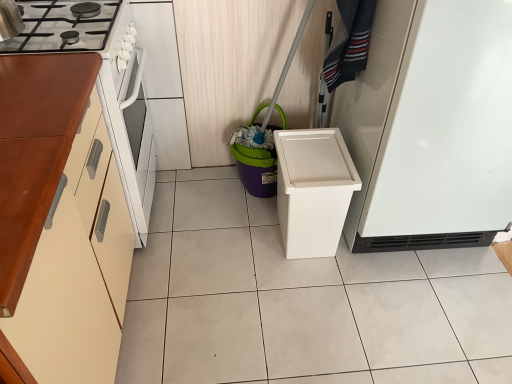
Question: Does purple plastic bucket at center have a lesser height compared to wooden cabinet at left?

Choices:
 (A) yes
 (B) no

Answer: (A)

Question: Is purple plastic bucket at center taller than wooden cabinet at left?

Choices:
 (A) yes
 (B) no

Answer: (B)

Question: Are purple plastic bucket at center and wooden cabinet at left far apart?

Choices:
 (A) yes
 (B) no

Answer: (B)

Question: Would you say wooden cabinet at left is part of purple plastic bucket at center's contents?

Choices:
 (A) yes
 (B) no

Answer: (B)

Question: Considering the relative positions of purple plastic bucket at center and wooden cabinet at left in the image provided, is purple plastic bucket at center behind wooden cabinet at left?

Choices:
 (A) no
 (B) yes

Answer: (B)

Question: Does purple plastic bucket at center have a smaller size compared to wooden cabinet at left?

Choices:
 (A) no
 (B) yes

Answer: (B)

Question: Is purple plastic bucket at center behind denim fabric laundry at upper right?

Choices:
 (A) no
 (B) yes

Answer: (B)

Question: From a real-world perspective, is purple plastic bucket at center positioned over denim fabric laundry at upper right based on gravity?

Choices:
 (A) yes
 (B) no

Answer: (B)

Question: Is purple plastic bucket at center closer to the viewer compared to denim fabric laundry at upper right?

Choices:
 (A) no
 (B) yes

Answer: (A)

Question: Can you confirm if purple plastic bucket at center is thinner than denim fabric laundry at upper right?

Choices:
 (A) no
 (B) yes

Answer: (A)

Question: Does purple plastic bucket at center appear on the right side of denim fabric laundry at upper right?

Choices:
 (A) yes
 (B) no

Answer: (B)

Question: Is denim fabric laundry at upper right surrounded by purple plastic bucket at center?

Choices:
 (A) yes
 (B) no

Answer: (B)

Question: Is white matte refrigerator at right surrounding purple plastic bucket at center?

Choices:
 (A) yes
 (B) no

Answer: (B)